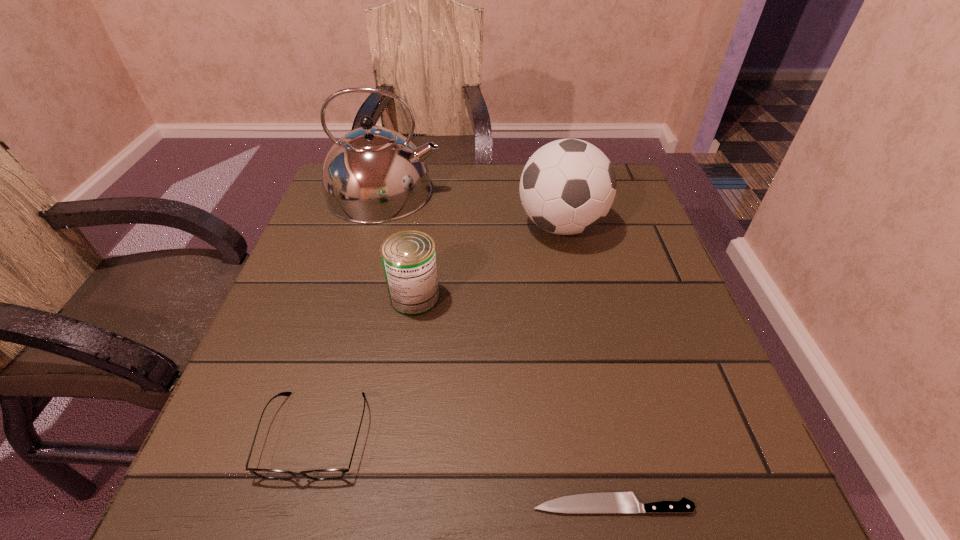
This screenshot has width=960, height=540. Find the location of `object positioned at the far left corner`. object positioned at the far left corner is located at coordinates (372, 175).

You are a GUI agent. You are given a task and a screenshot of the screen. Output one action in this format:
    pyautogui.click(x=<x>, y=<y>)
    Task: Click on the object that is at the near left corner
    This screenshot has height=540, width=960.
    Given the screenshot: What is the action you would take?
    pyautogui.click(x=322, y=474)

Locate an element on the screen. This screenshot has width=960, height=540. object that is at the far right corner is located at coordinates (568, 186).

The image size is (960, 540). In order to click on object present at the near right corner in this screenshot , I will do `click(597, 502)`.

Where is `vacant space at the far edge`? The image size is (960, 540). vacant space at the far edge is located at coordinates (450, 178).

Where is `free region at the near edge of the desktop`? free region at the near edge of the desktop is located at coordinates (626, 488).

In the image, there is a desktop. Identify the location of vacant space at the left edge. The image size is (960, 540). (348, 307).

Identify the location of free space at the right edge of the desktop. (696, 352).

The image size is (960, 540). What are the coordinates of `free space at the near left corner` in the screenshot? It's located at (226, 504).

Locate an element on the screen. This screenshot has width=960, height=540. free region at the far right corner of the desktop is located at coordinates (618, 199).